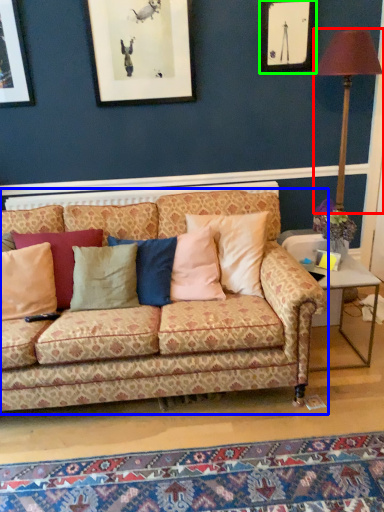
Question: Which is farther away from table lamp (highlighted by a red box)? studio couch (highlighted by a blue box) or picture frame (highlighted by a green box)?

Choices:
 (A) studio couch
 (B) picture frame

Answer: (A)